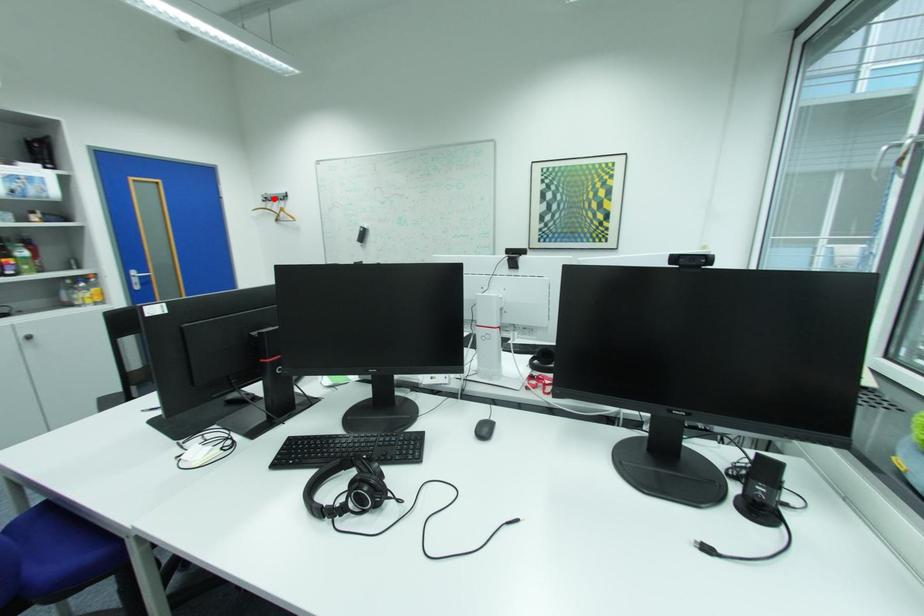
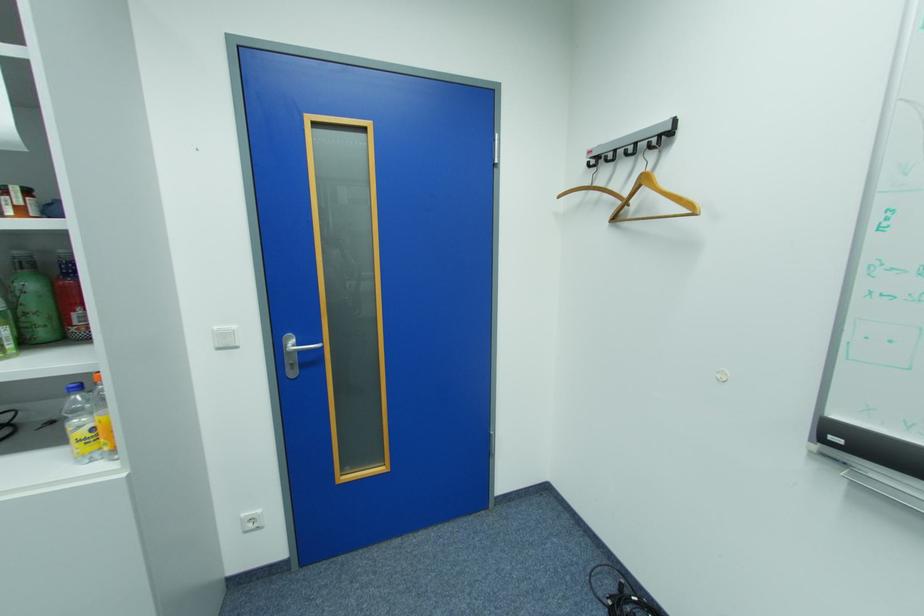
Locate, in the second image, the point that corresponds to the highlighted location in the first image.

(606, 159)